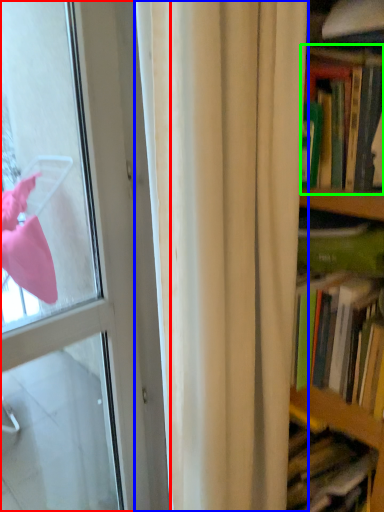
Question: Estimate the real-world distances between objects in this image. Which object is closer to door (highlighted by a red box), curtain (highlighted by a blue box) or book (highlighted by a green box)?

Choices:
 (A) curtain
 (B) book

Answer: (A)